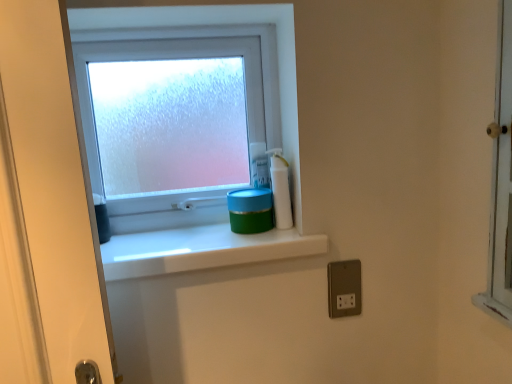
Where is `vacant space situated above green matte container at center (from a real-world perspective)`? vacant space situated above green matte container at center (from a real-world perspective) is located at coordinates (201, 236).